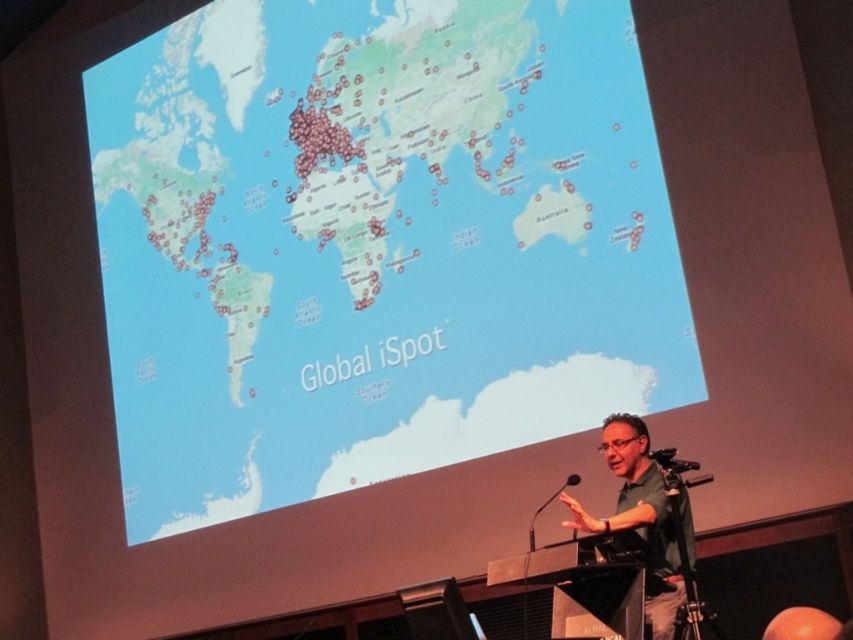
Does point (386, 42) come farther from viewer compared to point (532, 518)?

Yes, it is.

Who is more distant from viewer, (154, 452) or (531, 520)?

The point (154, 452) is behind.

Where is `matte map at center`? The height and width of the screenshot is (640, 853). matte map at center is located at coordinates (375, 244).

Who is more forward, (817, 612) or (560, 488)?

Point (817, 612) is more forward.

Can you confirm if orange matte ball at lower right is shorter than black plastic microphone at lower center?

Indeed, orange matte ball at lower right has a lesser height compared to black plastic microphone at lower center.

The image size is (853, 640). I want to click on orange matte ball at lower right, so click(x=801, y=625).

What are the coordinates of `orange matte ball at lower right` in the screenshot? It's located at (801, 625).

Does matte map at center have a lesser width compared to green fabric shirt at lower right?

No.

Is point (476, 252) farther from viewer compared to point (660, 572)?

That is True.

The image size is (853, 640). Find the location of `matte map at center`. matte map at center is located at coordinates (375, 244).